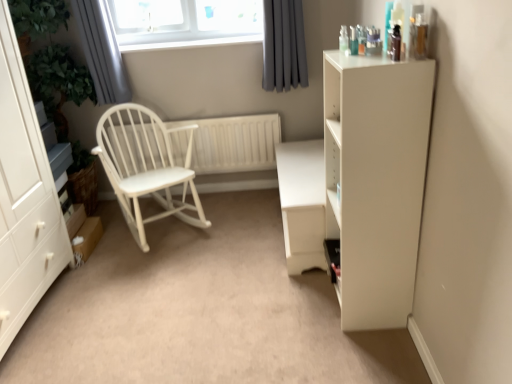
Question: Is white matte cabinet at right taller or shorter than white wood radiator at center?

Choices:
 (A) short
 (B) tall

Answer: (B)

Question: Choose the correct answer: Is white matte cabinet at right inside white wood radiator at center or outside it?

Choices:
 (A) inside
 (B) outside

Answer: (B)

Question: Based on their relative distances, which object is farther from the gray fabric curtain at upper center, which is counted as the 1th curtain, starting from the right?

Choices:
 (A) white wood desk at center
 (B) white wood radiator at center
 (C) white matte table at center
 (D) gray fabric curtain at upper left, acting as the 2th curtain starting from the right
 (E) white matte cabinet at left

Answer: (E)

Question: Which object is the farthest from the white wood desk at center?

Choices:
 (A) white wood rocking chair at left
 (B) white matte table at center
 (C) gray fabric curtain at upper center, which is counted as the 1th curtain, starting from the right
 (D) white matte cabinet at left
 (E) white matte cabinet at right

Answer: (C)